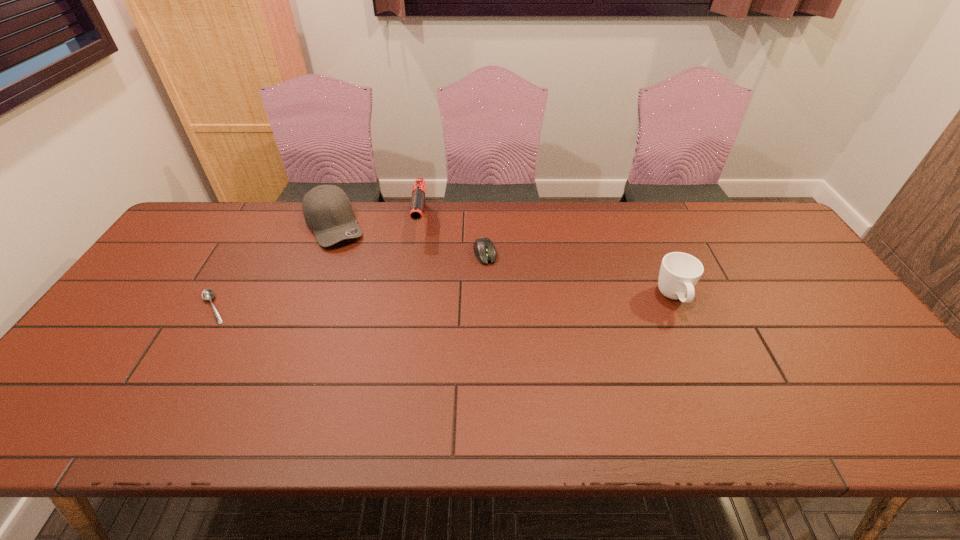
Locate an element on the screen. This screenshot has height=540, width=960. computer mouse present at the far edge is located at coordinates (484, 249).

Where is `baseball cap positioned at the far edge`? The width and height of the screenshot is (960, 540). baseball cap positioned at the far edge is located at coordinates (327, 210).

I want to click on free space at the far edge of the desktop, so click(369, 212).

Where is `free space at the near edge`? free space at the near edge is located at coordinates (455, 377).

Identify the location of free space at the right edge of the desktop. (841, 321).

Where is `vacant area at the far left corner of the desktop`? This screenshot has height=540, width=960. vacant area at the far left corner of the desktop is located at coordinates (200, 219).

Where is `vacant space at the far right corner of the desktop`? vacant space at the far right corner of the desktop is located at coordinates [x=729, y=229].

I want to click on free spot between the third object from right to left and the computer mouse, so click(453, 238).

In order to click on vacant area that lies between the second object from right to left and the third object from left to right in this screenshot , I will do click(453, 238).

Where is `free point between the third object from left to right and the baseball cap`? The height and width of the screenshot is (540, 960). free point between the third object from left to right and the baseball cap is located at coordinates (378, 224).